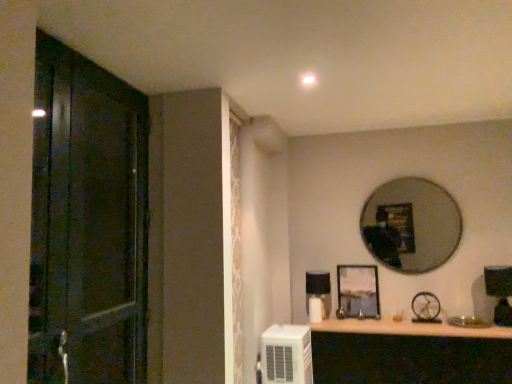
You are a GUI agent. You are given a task and a screenshot of the screen. Output one action in this format:
    pyautogui.click(x=<x>, y=<y>)
    Task: Click on the vacant space situated above dark wood door at left (from a real-world perspective)
    
    Given the screenshot: What is the action you would take?
    pyautogui.click(x=89, y=54)